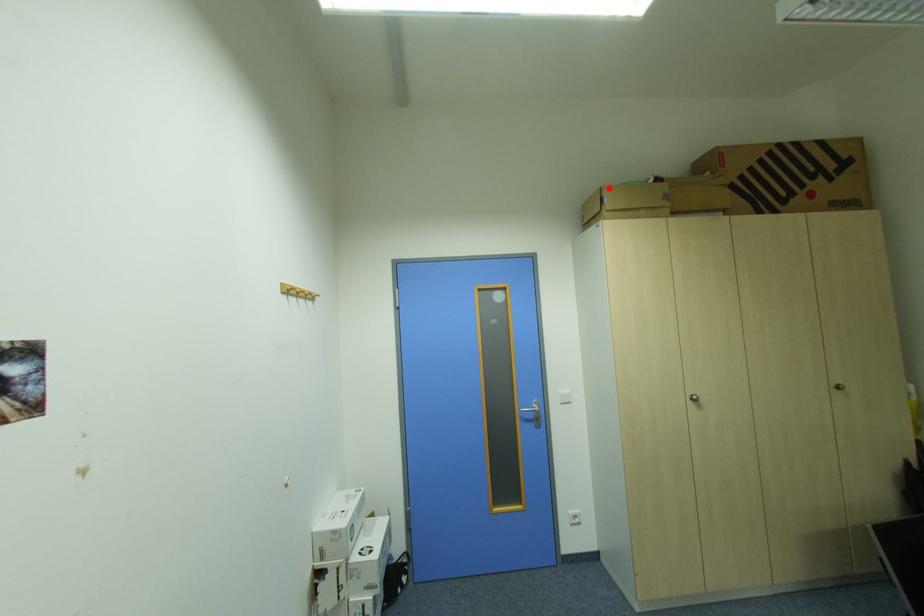
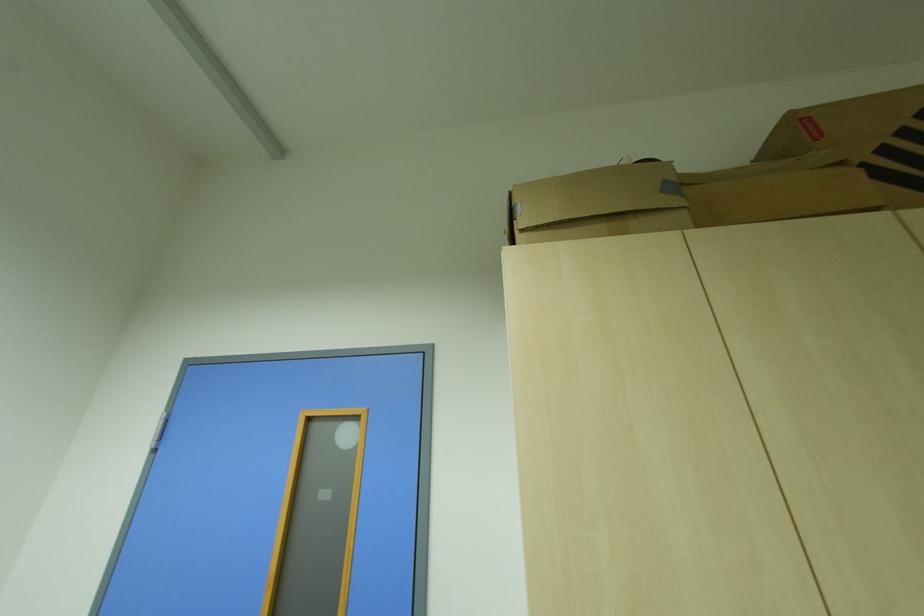
Find the pixel in the second image that matches the highlighted location in the first image.

(517, 195)